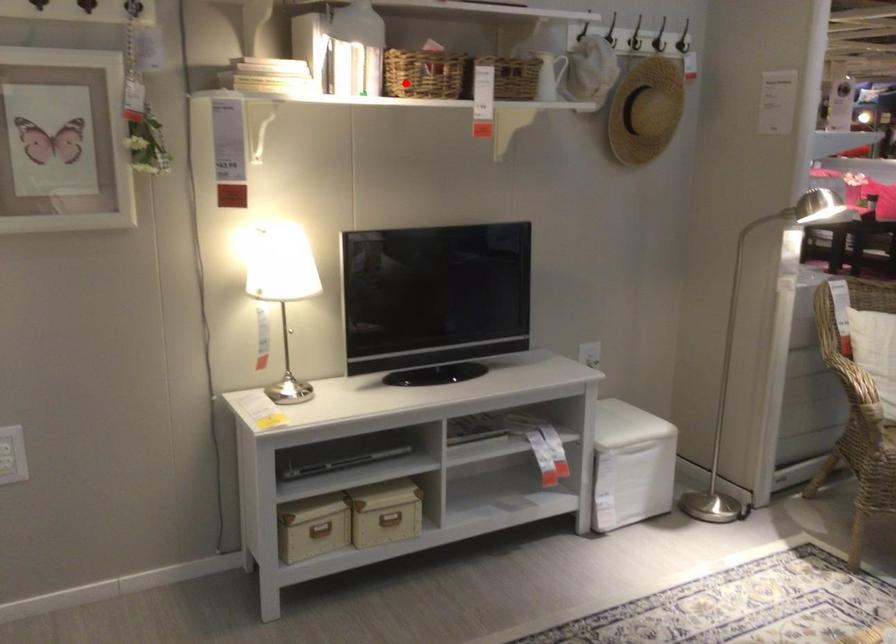
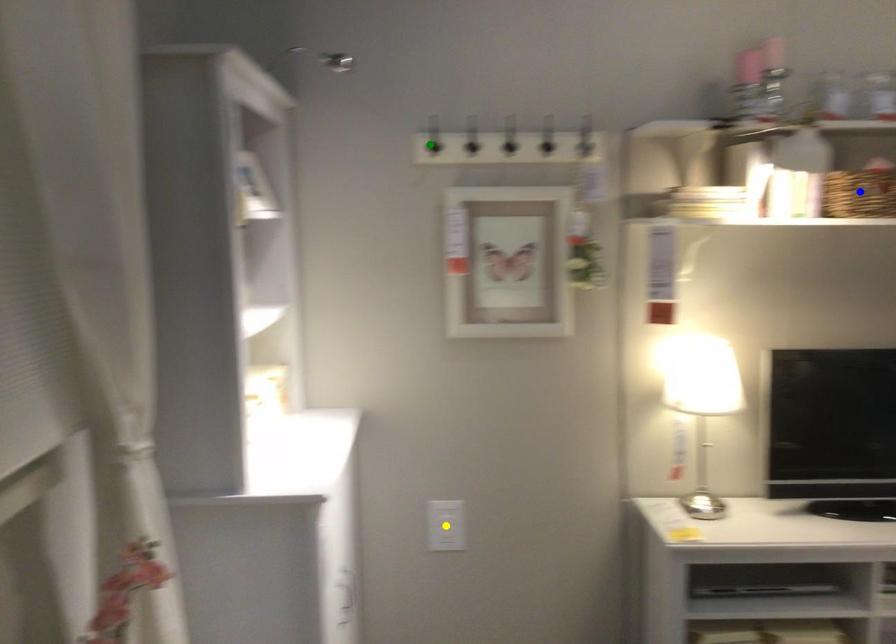
Question: I am providing you with two images of the same scene from different viewpoints. A red point is marked on the first image. You are given multiple points on the second image. Which mark in image 2 goes with the point in image 1?

Choices:
 (A) blue point
 (B) yellow point
 (C) green point

Answer: (A)